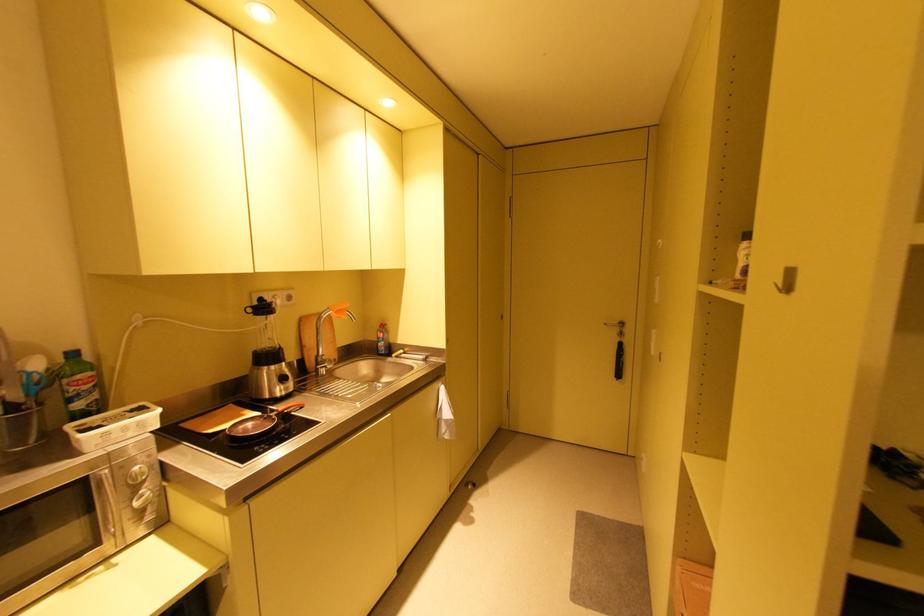
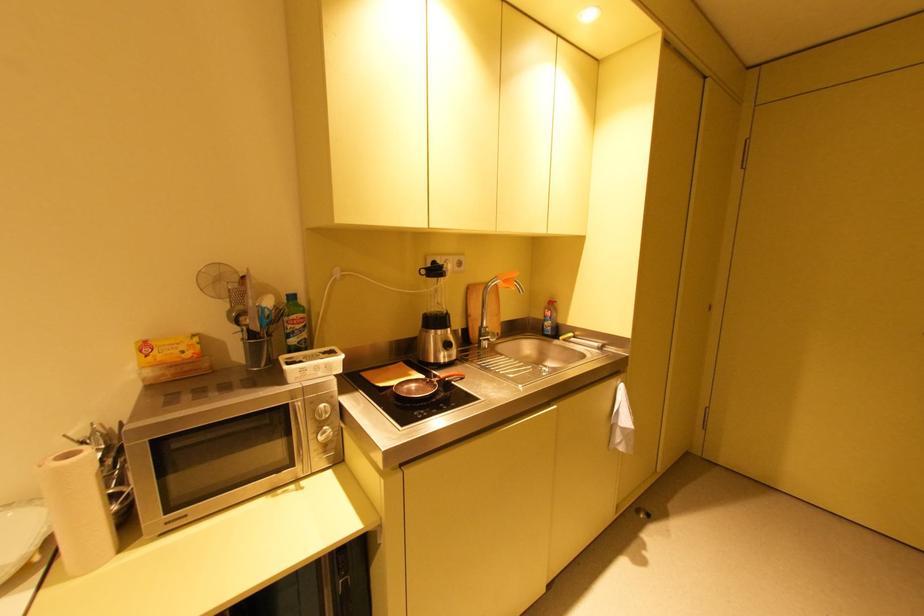
In the second image, find the point that corresponds to (342,312) in the first image.

(508, 282)